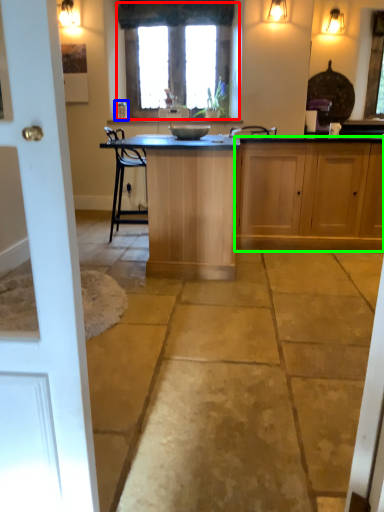
Question: Based on their relative distances, which object is nearer to window (highlighted by a red box)? Choose from faucet (highlighted by a blue box) and cabinetry (highlighted by a green box).

Choices:
 (A) faucet
 (B) cabinetry

Answer: (A)